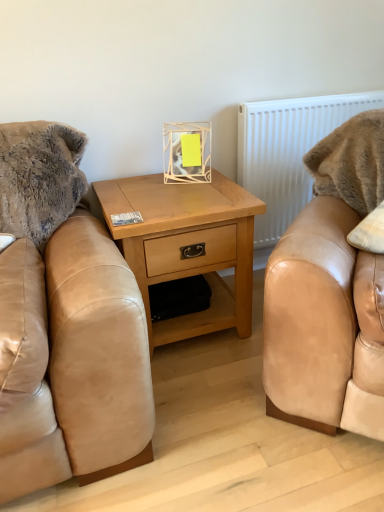
You are a GUI agent. You are given a task and a screenshot of the screen. Output one action in this format:
    pyautogui.click(x=<x>, y=<y>)
    Task: Click on the blank space situated above light wood/texture nightstand at center (from a real-world perspective)
    The height and width of the screenshot is (512, 384).
    Given the screenshot: What is the action you would take?
    pyautogui.click(x=161, y=189)